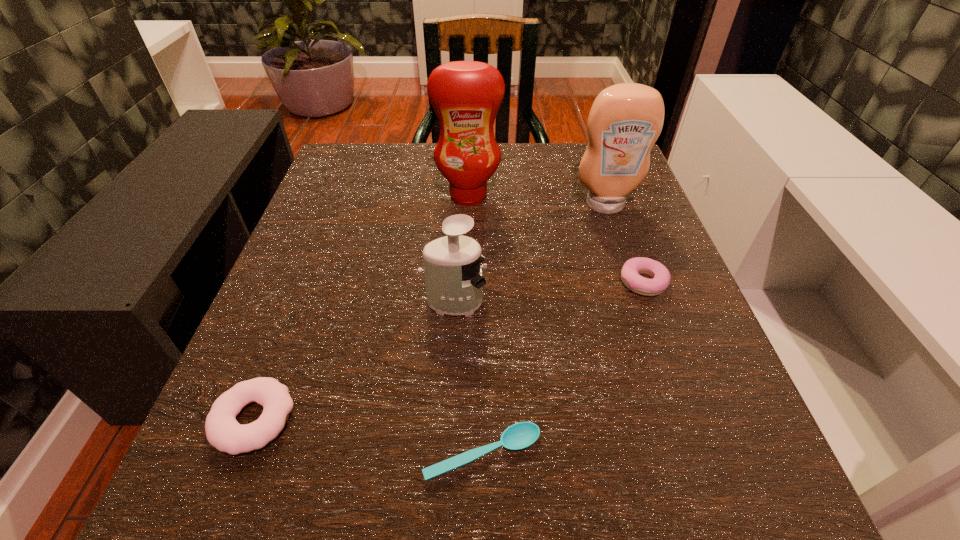
You are a GUI agent. You are given a task and a screenshot of the screen. Output one action in this format:
    pyautogui.click(x=<x>, y=<y>)
    Task: Click on the free point between the juicer and the shortest object
    
    Given the screenshot: What is the action you would take?
    pos(468,378)

Locate an element on the screen. This screenshot has height=540, width=960. free space between the third tallest object and the pastry is located at coordinates (548, 292).

You are a GUI agent. You are given a task and a screenshot of the screen. Output one action in this format:
    pyautogui.click(x=<x>, y=<y>)
    Task: Click on the free space between the spoon and the leftmost object
    This screenshot has height=540, width=960.
    Given the screenshot: What is the action you would take?
    point(369,437)

The image size is (960, 540). I want to click on free space between the leftmost object and the third tallest object, so [x=354, y=361].

Locate an element on the screen. object that is the third nearest to the left condiment is located at coordinates (633, 267).

Identify the location of object that can be found as the third closest to the right condiment. (453, 277).

At what (x,y) coordinates should I click in order to perform the action: click on vacant space that satisfies the following two spatial constraints: 1. on the label of the pastry; 2. on the right side of the right condiment. Please return your answer as a coordinate pair (x, y). Looking at the image, I should click on (632, 282).

Image resolution: width=960 pixels, height=540 pixels. Identify the location of free region that satisfies the following two spatial constraints: 1. on the label side of the left condiment; 2. on the right side of the pastry. (466, 282).

The width and height of the screenshot is (960, 540). What are the coordinates of `vacant position in the image that satisfies the following two spatial constraints: 1. on the label of the pastry; 2. on the left side of the right condiment` in the screenshot? It's located at (632, 282).